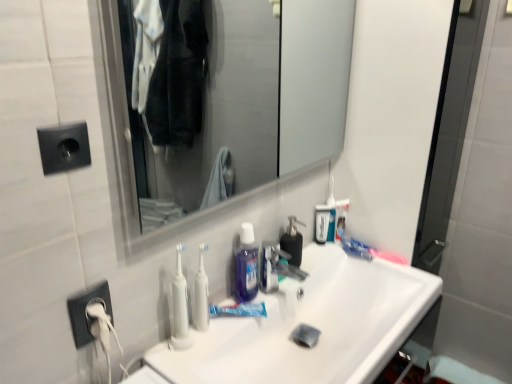
I want to click on vacant area that is in front of white plastic toothbrush at center, positioned as the 2th toothbrush in back-to-front order, so click(x=195, y=358).